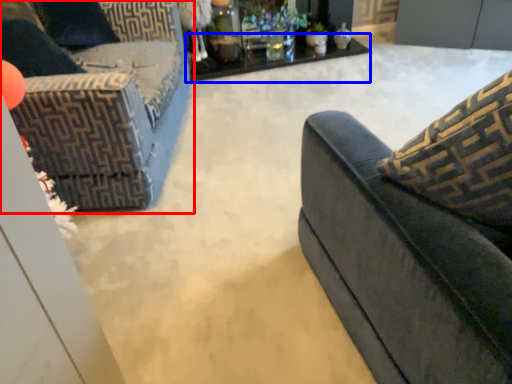
Question: Which point is closer to the camera, studio couch (highlighted by a red box) or table (highlighted by a blue box)?

Choices:
 (A) studio couch
 (B) table

Answer: (A)